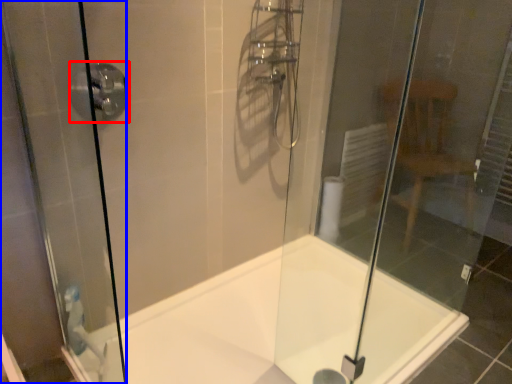
Question: Which of the following is the farthest to the observer, shower (highlighted by a red box) or screen door (highlighted by a blue box)?

Choices:
 (A) shower
 (B) screen door

Answer: (A)